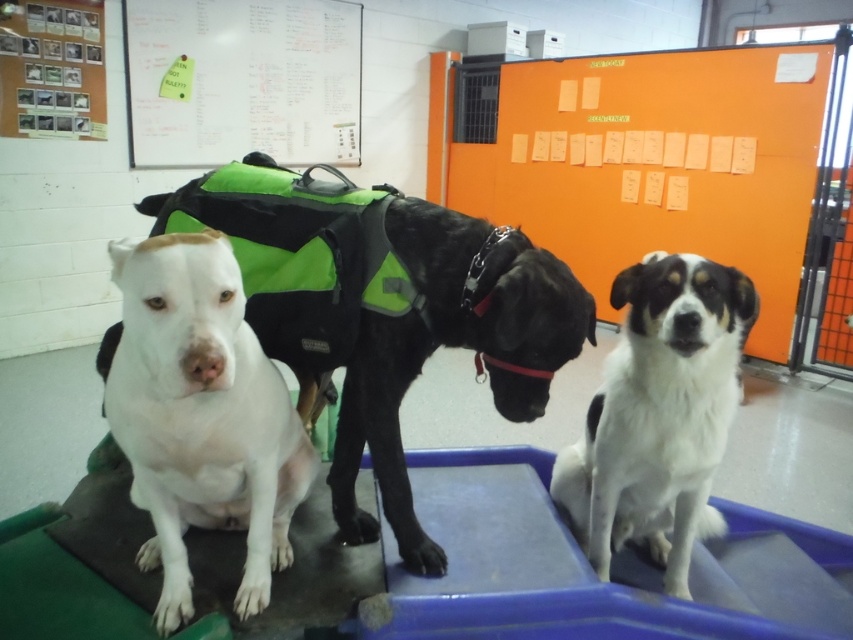
Question: Where is white fur dog at center located in relation to whiteboard at upper center in the image?

Choices:
 (A) below
 (B) above

Answer: (A)

Question: Which object appears closest to the camera in this image?

Choices:
 (A) white matte dog at left
 (B) whiteboard at upper center
 (C) white fur dog at left

Answer: (C)

Question: From the image, what is the correct spatial relationship of white matte dog at left in relation to white fur dog at center?

Choices:
 (A) right
 (B) left

Answer: (B)

Question: Can you confirm if white fur dog at center is smaller than whiteboard at upper center?

Choices:
 (A) yes
 (B) no

Answer: (A)

Question: Among these points, which one is nearest to the camera?

Choices:
 (A) (498, 339)
 (B) (343, 150)
 (C) (238, 358)

Answer: (C)

Question: Considering the real-world distances, which object is farthest from the white fur dog at center?

Choices:
 (A) whiteboard at upper center
 (B) white matte dog at left
 (C) white fur dog at left

Answer: (A)